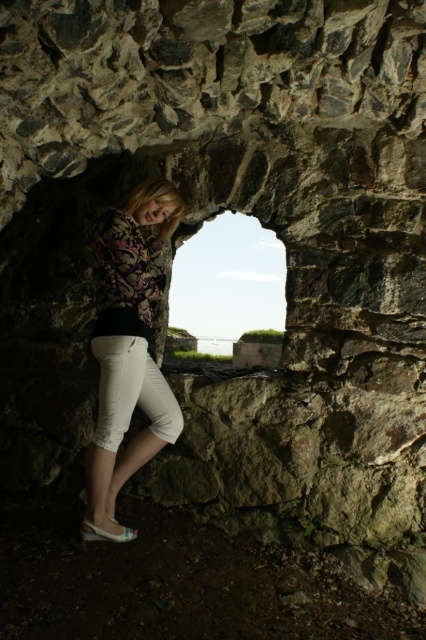
Question: Which of the following is the closest to the observer?

Choices:
 (A) white cotton pants at lower left
 (B) transparent glass window at center

Answer: (A)

Question: Can you confirm if transparent glass window at center is wider than white cotton pants at lower left?

Choices:
 (A) no
 (B) yes

Answer: (B)

Question: Which of these objects is positioned farthest from the white cotton pants at lower left?

Choices:
 (A) matte floral blouse at center
 (B) transparent glass window at center

Answer: (B)

Question: Which point is closer to the camera?

Choices:
 (A) (169, 436)
 (B) (95, 500)
 (C) (270, 337)

Answer: (B)

Question: Can you confirm if matte floral blouse at center is positioned to the left of transparent glass window at center?

Choices:
 (A) no
 (B) yes

Answer: (B)

Question: Where is matte floral blouse at center located in relation to transparent glass window at center in the image?

Choices:
 (A) left
 (B) right

Answer: (A)